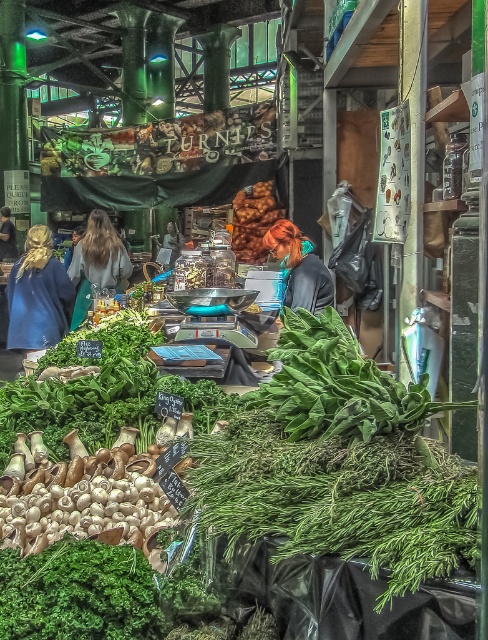
Question: Does light brown hair at center come in front of light blue fabric at center?

Choices:
 (A) yes
 (B) no

Answer: (A)

Question: Is blue fabric at left thinner than blue fabric jacket at left?

Choices:
 (A) yes
 (B) no

Answer: (B)

Question: Which point is closer to the camera?

Choices:
 (A) (267, 248)
 (B) (44, 579)

Answer: (B)

Question: Where is brown crumbly at center located in relation to light blue fabric at center in the image?

Choices:
 (A) left
 (B) right

Answer: (B)

Question: Which object is farther from the camera taking this photo?

Choices:
 (A) blue fabric jacket at left
 (B) light blue fabric at center
 (C) light brown hair at center
 (D) brown crumbly at center

Answer: (A)

Question: Which point is closer to the camera?

Choices:
 (A) green leafy at center
 (B) shiny blue hair at center

Answer: (A)